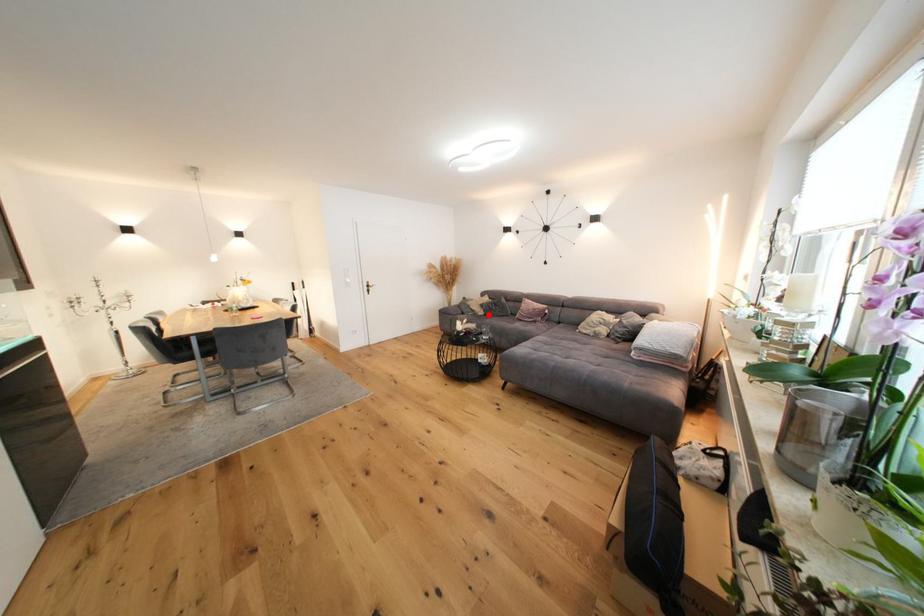
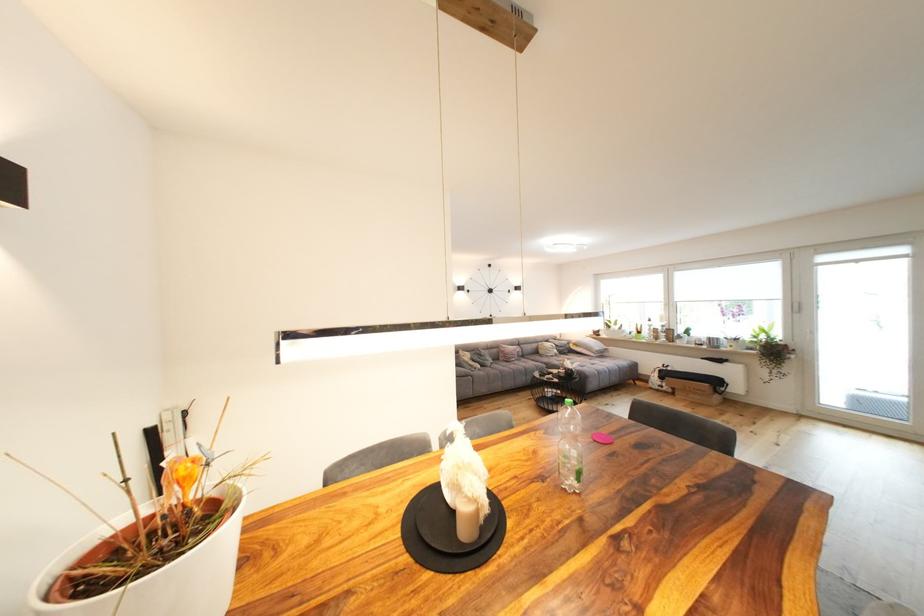
Question: I am providing you with two images of the same scene from different viewpoints. Given a red point in image1, look at the same physical point in image2. Is it:

Choices:
 (A) Closer to the viewpoint
 (B) Farther from the viewpoint

Answer: (B)